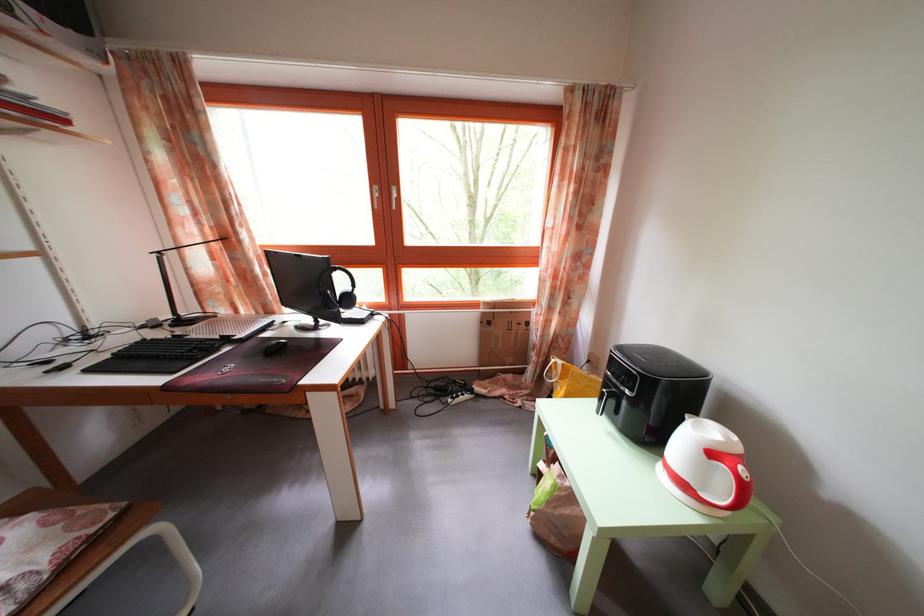
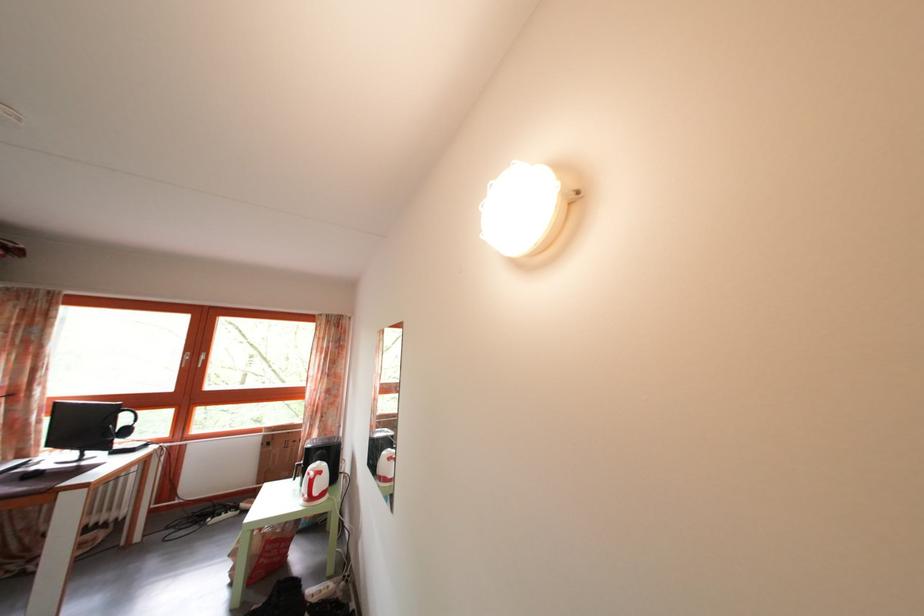
Locate, in the second image, the point that corresponds to [747,464] in the first image.

(327, 480)